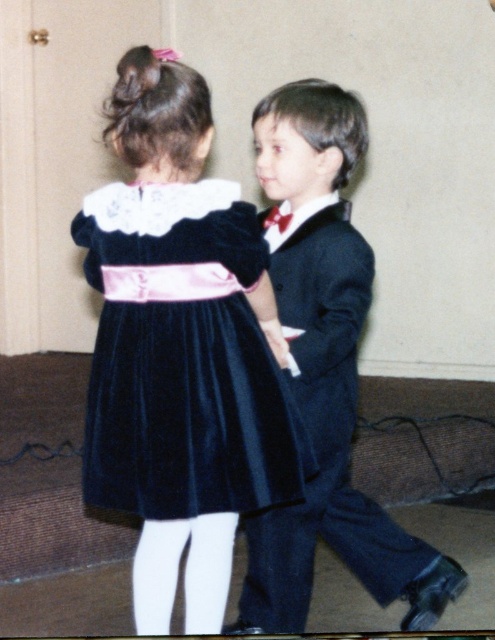
Question: Does velvet dark blue dress at center appear under velvet suit at center?

Choices:
 (A) yes
 (B) no

Answer: (B)

Question: Does velvet dark blue dress at center appear over velvet suit at center?

Choices:
 (A) yes
 (B) no

Answer: (A)

Question: Does velvet dark blue dress at center come behind velvet suit at center?

Choices:
 (A) no
 (B) yes

Answer: (A)

Question: Among these objects, which one is nearest to the camera?

Choices:
 (A) velvet suit at center
 (B) velvet dark blue dress at center

Answer: (B)

Question: Among these objects, which one is nearest to the camera?

Choices:
 (A) velvet suit at center
 (B) velvet dark blue dress at center

Answer: (B)